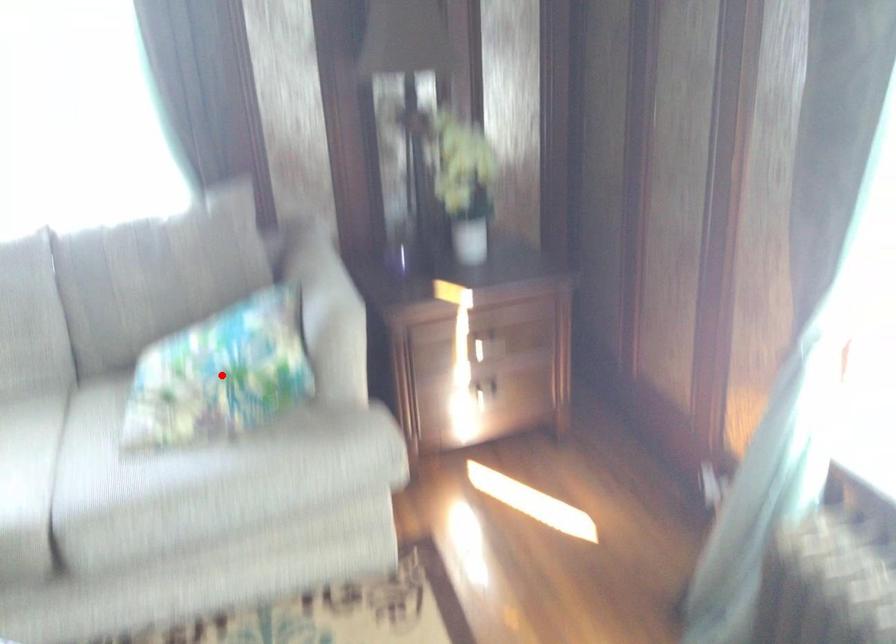
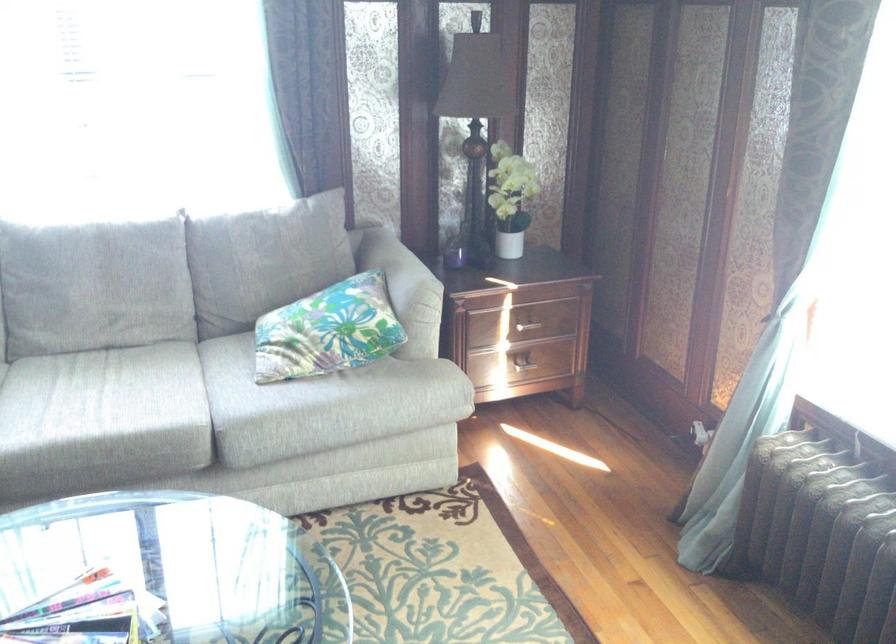
Locate, in the second image, the point that corresponds to the highlighted location in the first image.

(328, 330)